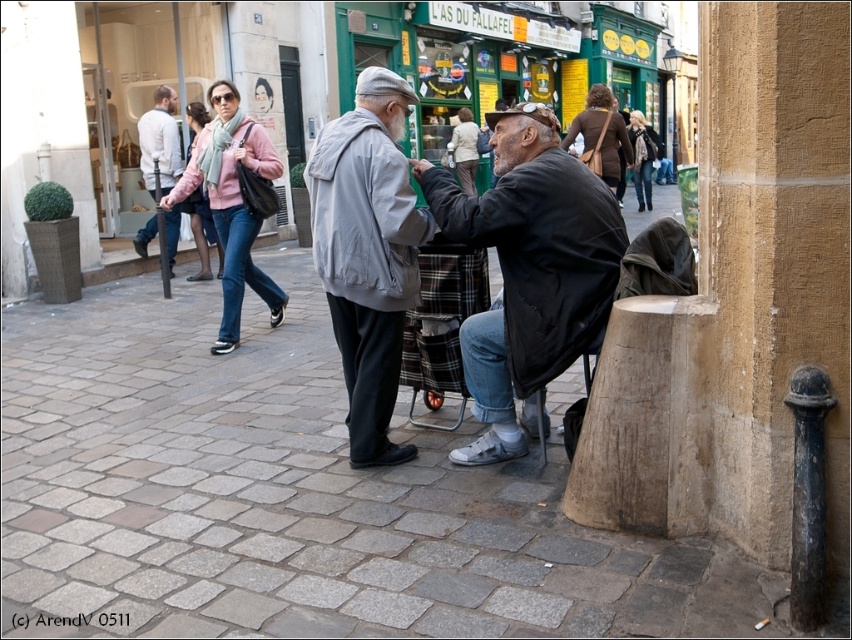
Question: Is dark gray jacket at center smaller than plaid fabric chair at center?

Choices:
 (A) yes
 (B) no

Answer: (B)

Question: Is plaid fabric chair at center thinner than white cotton sweater at left?

Choices:
 (A) no
 (B) yes

Answer: (B)

Question: Estimate the real-world distances between objects in this image. Which object is closer to the gray fabric jacket at center?

Choices:
 (A) plaid fabric chair at center
 (B) dark gray jacket at center

Answer: (A)

Question: Which point is closer to the camera?

Choices:
 (A) (426, 376)
 (B) (272, 480)

Answer: (B)

Question: Can you confirm if dark gray jacket at center is thinner than plaid fabric chair at center?

Choices:
 (A) yes
 (B) no

Answer: (B)

Question: Based on their relative distances, which object is nearer to the gray fabric jacket at center?

Choices:
 (A) plaid fabric chair at center
 (B) dark gray jacket at center

Answer: (A)